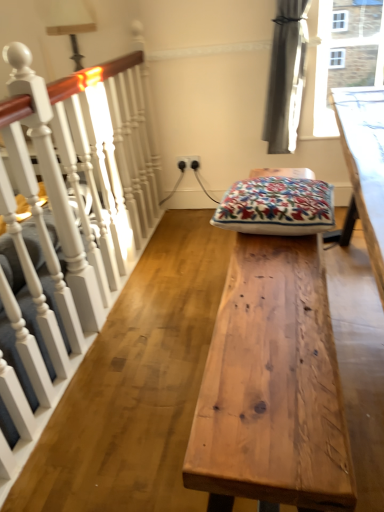
Question: Considering the relative sizes of natural wood table at center and white painted wood at left in the image provided, is natural wood table at center taller than white painted wood at left?

Choices:
 (A) no
 (B) yes

Answer: (A)

Question: Considering the relative positions of natural wood table at center and white painted wood at left in the image provided, is natural wood table at center to the left of white painted wood at left from the viewer's perspective?

Choices:
 (A) yes
 (B) no

Answer: (B)

Question: Does natural wood table at center have a smaller size compared to white painted wood at left?

Choices:
 (A) no
 (B) yes

Answer: (B)

Question: From the image's perspective, is natural wood table at center below white painted wood at left?

Choices:
 (A) yes
 (B) no

Answer: (A)

Question: Can you confirm if natural wood table at center is wider than white painted wood at left?

Choices:
 (A) yes
 (B) no

Answer: (A)

Question: Is natural wood table at center outside white painted wood at left?

Choices:
 (A) yes
 (B) no

Answer: (A)

Question: Does natural wood table at center have a smaller size compared to embroidered cotton cushion at center?

Choices:
 (A) yes
 (B) no

Answer: (B)

Question: From a real-world perspective, does natural wood table at center stand above embroidered cotton cushion at center?

Choices:
 (A) yes
 (B) no

Answer: (B)

Question: From a real-world perspective, is natural wood table at center under embroidered cotton cushion at center?

Choices:
 (A) no
 (B) yes

Answer: (B)

Question: Is natural wood table at center not near embroidered cotton cushion at center?

Choices:
 (A) yes
 (B) no

Answer: (B)

Question: Could embroidered cotton cushion at center be considered to be inside natural wood table at center?

Choices:
 (A) yes
 (B) no

Answer: (B)

Question: Can you confirm if natural wood table at center is shorter than embroidered cotton cushion at center?

Choices:
 (A) yes
 (B) no

Answer: (B)

Question: Considering the relative sizes of white painted wood at left and embroidered cotton cushion at center in the image provided, is white painted wood at left wider than embroidered cotton cushion at center?

Choices:
 (A) yes
 (B) no

Answer: (B)